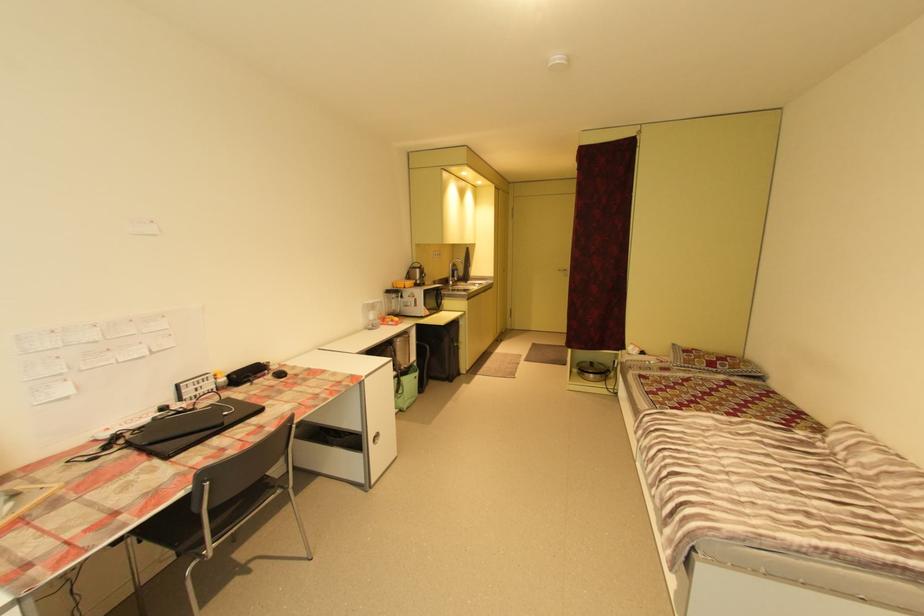
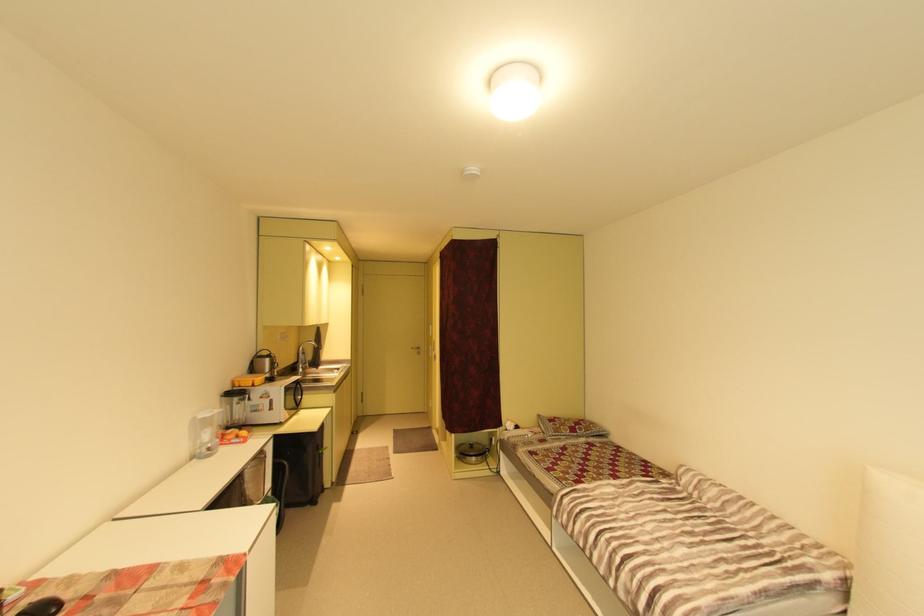
The point at (x=442, y=301) is marked in the first image. Where is the corresponding point in the second image?

(299, 398)